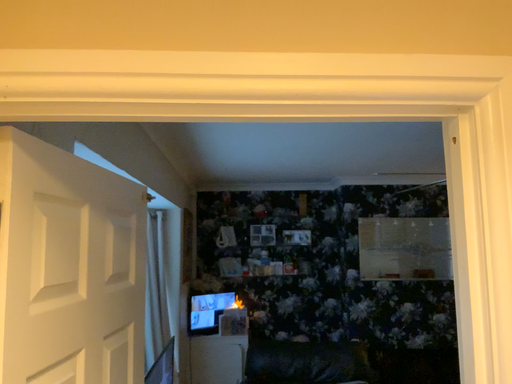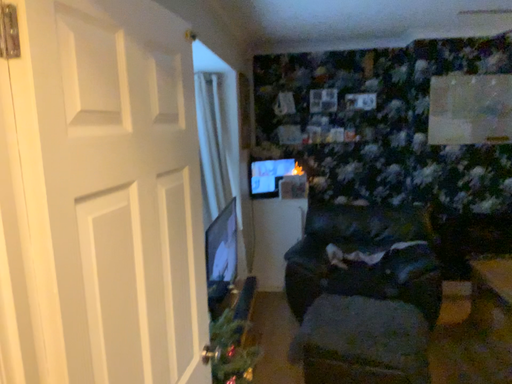
Question: Which way did the camera rotate in the video?

Choices:
 (A) rotated downward
 (B) rotated upward

Answer: (A)